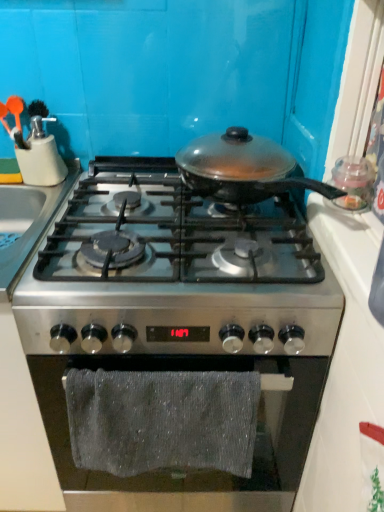
Question: Is matte plastic utensil holder at upper left at the back of gray textured towel at lower center?

Choices:
 (A) yes
 (B) no

Answer: (B)

Question: Does gray textured towel at lower center appear on the right side of matte plastic utensil holder at upper left?

Choices:
 (A) yes
 (B) no

Answer: (A)

Question: Is gray textured towel at lower center smaller than matte plastic utensil holder at upper left?

Choices:
 (A) no
 (B) yes

Answer: (A)

Question: Is gray textured towel at lower center not near matte plastic utensil holder at upper left?

Choices:
 (A) no
 (B) yes

Answer: (A)

Question: Does gray textured towel at lower center have a greater height compared to matte plastic utensil holder at upper left?

Choices:
 (A) no
 (B) yes

Answer: (B)

Question: From a real-world perspective, is gray textured towel at lower center physically below matte plastic utensil holder at upper left?

Choices:
 (A) yes
 (B) no

Answer: (A)

Question: From a real-world perspective, is gray textured towel at lower center located beneath stainless steel gas stove at center, the second gas stove ordered from the bottom?

Choices:
 (A) yes
 (B) no

Answer: (A)

Question: Is gray textured towel at lower center shorter than stainless steel gas stove at center, which is the first gas stove in top-to-bottom order?

Choices:
 (A) no
 (B) yes

Answer: (A)

Question: Considering the relative sizes of gray textured towel at lower center and stainless steel gas stove at center, the second gas stove ordered from the bottom, in the image provided, is gray textured towel at lower center thinner than stainless steel gas stove at center, the second gas stove ordered from the bottom,?

Choices:
 (A) no
 (B) yes

Answer: (B)

Question: Is stainless steel gas stove at center, which is the first gas stove in top-to-bottom order, at the back of gray textured towel at lower center?

Choices:
 (A) no
 (B) yes

Answer: (B)

Question: Does gray textured towel at lower center have a larger size compared to stainless steel gas stove at center, the second gas stove ordered from the bottom?

Choices:
 (A) yes
 (B) no

Answer: (B)

Question: Is the surface of gray textured towel at lower center in direct contact with stainless steel gas stove at center, which is the first gas stove in top-to-bottom order?

Choices:
 (A) no
 (B) yes

Answer: (A)

Question: From the image's perspective, is matte plastic utensil holder at upper left above stainless steel gas stove at center, the second gas stove ordered from the bottom?

Choices:
 (A) no
 (B) yes

Answer: (B)